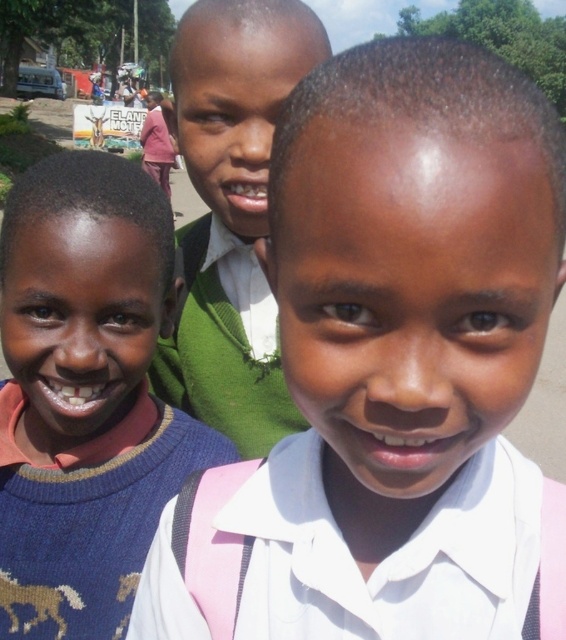
Question: Is pink fabric at center thinner than blue knitted sweater at left?

Choices:
 (A) no
 (B) yes

Answer: (A)

Question: Does pink fabric at center appear on the right side of green sweater at center?

Choices:
 (A) yes
 (B) no

Answer: (A)

Question: Among these objects, which one is farthest from the camera?

Choices:
 (A) blue knitted sweater at left
 (B) pink fabric at center

Answer: (A)

Question: Which object is positioned closest to the green sweater at center?

Choices:
 (A) pink fabric at center
 (B) blue knitted sweater at left

Answer: (B)

Question: Estimate the real-world distances between objects in this image. Which object is closer to the blue knitted sweater at left?

Choices:
 (A) pink fabric at center
 (B) green sweater at center

Answer: (B)

Question: Does pink fabric at center have a lesser width compared to green sweater at center?

Choices:
 (A) yes
 (B) no

Answer: (B)